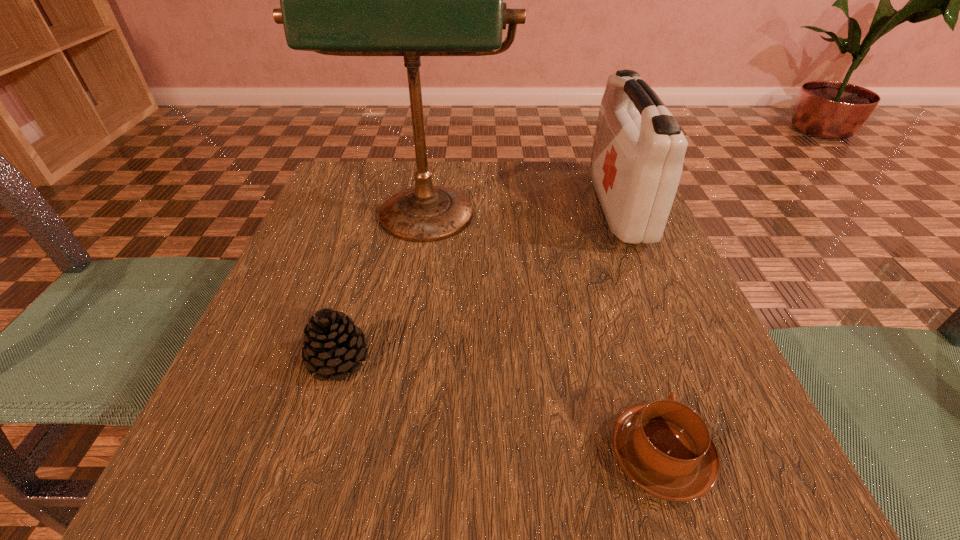
I want to click on free space located 0.390m at the narrow end of the pinecone, so click(x=625, y=360).

Locate an element on the screen. This screenshot has height=540, width=960. vacant region located 0.060m on the side of the shortest object with the handle is located at coordinates (635, 374).

Locate an element on the screen. The image size is (960, 540). free space located on the side of the shortest object with the handle is located at coordinates (593, 242).

The height and width of the screenshot is (540, 960). Identify the location of vacant space located 0.200m on the side of the shortest object with the handle. (613, 306).

Identify the location of table lamp situated at the far edge. (411, 0).

The image size is (960, 540). What are the coordinates of `the first-aid kit located in the far edge section of the desktop` in the screenshot? It's located at (637, 159).

Image resolution: width=960 pixels, height=540 pixels. I want to click on object at the near edge, so click(664, 447).

The width and height of the screenshot is (960, 540). What are the coordinates of `table lamp positioned at the left edge` in the screenshot? It's located at (411, 0).

I want to click on pinecone at the left edge, so click(x=333, y=345).

Identify the location of the first-aid kit positioned at the right edge. (637, 159).